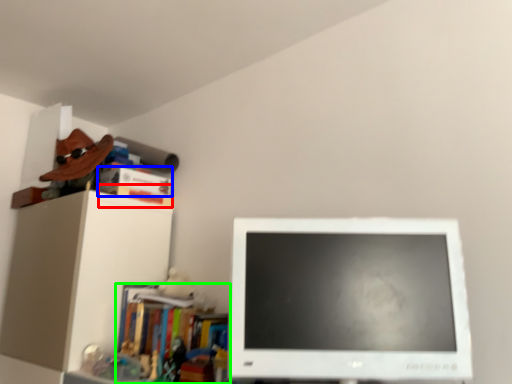
Question: Based on their relative distances, which object is nearer to book (highlighted by a red box)? Choose from book (highlighted by a blue box) and book (highlighted by a green box).

Choices:
 (A) book
 (B) book

Answer: (A)